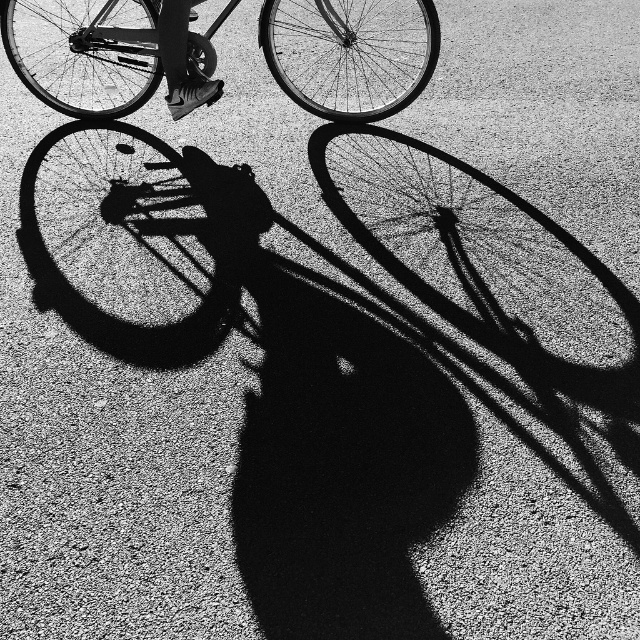
Question: Does metallic silver bicycle at upper center lie behind shiny black shoe at upper center?

Choices:
 (A) no
 (B) yes

Answer: (B)

Question: Among these objects, which one is nearest to the camera?

Choices:
 (A) metallic silver bicycle at upper center
 (B) shiny black shoe at upper center

Answer: (B)

Question: Which point is farther from the camera taking this photo?

Choices:
 (A) (147, 61)
 (B) (218, 83)

Answer: (A)

Question: Can you confirm if metallic silver bicycle at upper center is positioned to the left of shiny black shoe at upper center?

Choices:
 (A) yes
 (B) no

Answer: (B)

Question: Can you confirm if metallic silver bicycle at upper center is bigger than shiny black shoe at upper center?

Choices:
 (A) yes
 (B) no

Answer: (A)